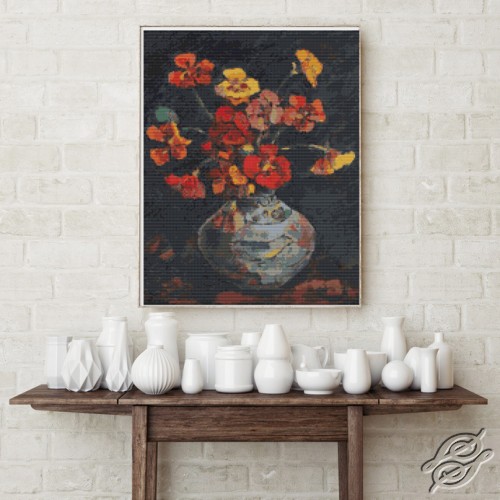
I want to click on vase, so click(x=430, y=385).